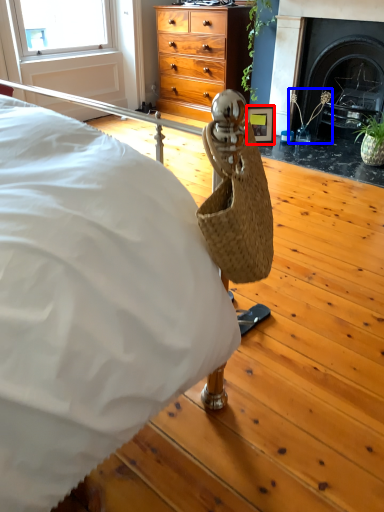
Question: Which object is further to the camera taking this photo, picture frame (highlighted by a red box) or plant (highlighted by a blue box)?

Choices:
 (A) picture frame
 (B) plant

Answer: (A)